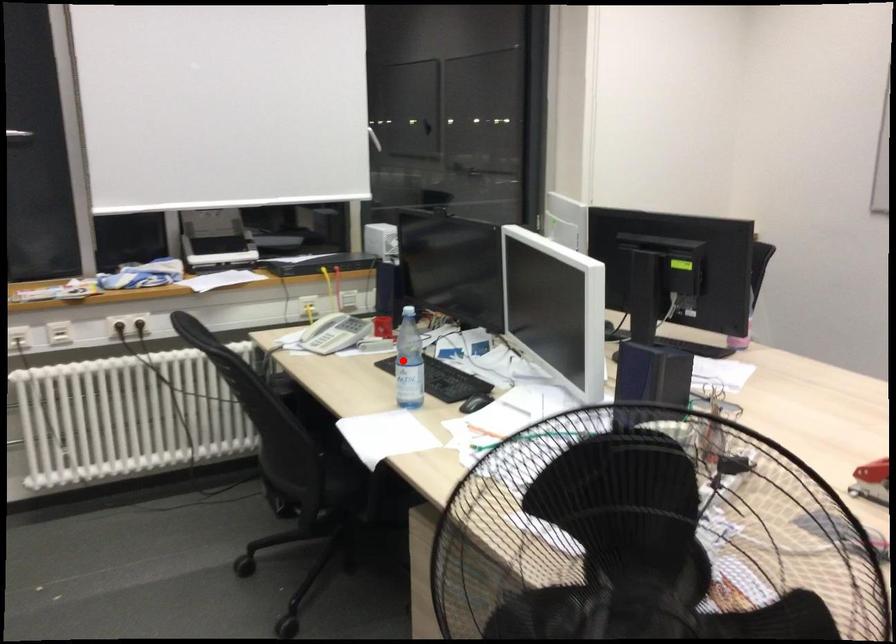
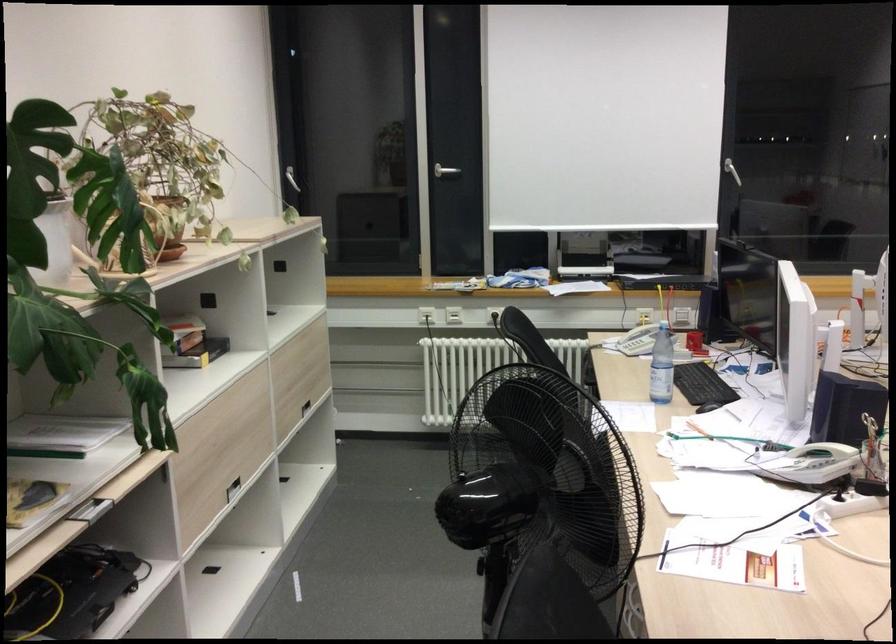
Question: I am providing you with two images of the same scene from different viewpoints. Given a red point in image1, look at the same physical point in image2. Is it:

Choices:
 (A) Closer to the viewpoint
 (B) Farther from the viewpoint

Answer: (B)